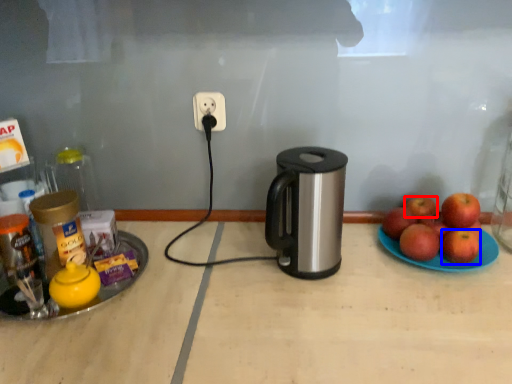
Question: Which object is further to the camera taking this photo, apple (highlighted by a red box) or apple (highlighted by a blue box)?

Choices:
 (A) apple
 (B) apple

Answer: (A)